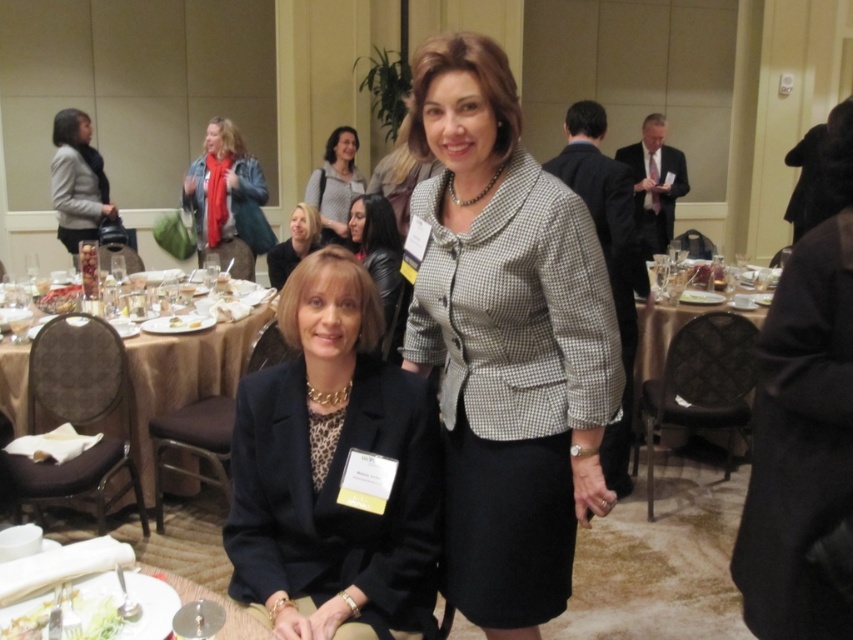
You are a photographer at the event and want to capture both the gold fabric table at lower left and the leather jacket at center in the same frame. Based on their positions, which object should you focus on first to ensure both are in focus?

The gold fabric table at lower left is below the leather jacket at center, so you should focus on the leather jacket at center first to ensure both are in focus since it is closer to the camera.

You are a photographer at the event and need to position yourself to capture a clear shot of the gold fabric table at lower left. Based on its coordinates, where should you stand to ensure it is centered in your viewfinder?

To center the gold fabric table at lower left at point [184,372] in your viewfinder, position yourself directly in front of the table at that coordinate point, ensuring the table is framed centrally in your shot.